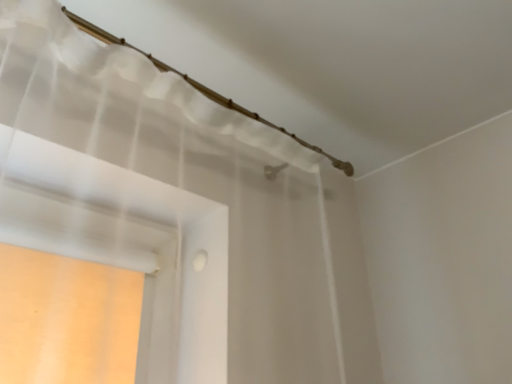
The image size is (512, 384). What do you see at coordinates (151, 78) in the screenshot? I see `sheer white curtain at upper left` at bounding box center [151, 78].

The image size is (512, 384). Find the location of `sheer white curtain at upper left`. sheer white curtain at upper left is located at coordinates (151, 78).

The width and height of the screenshot is (512, 384). I want to click on sheer white curtain at upper left, so click(x=151, y=78).